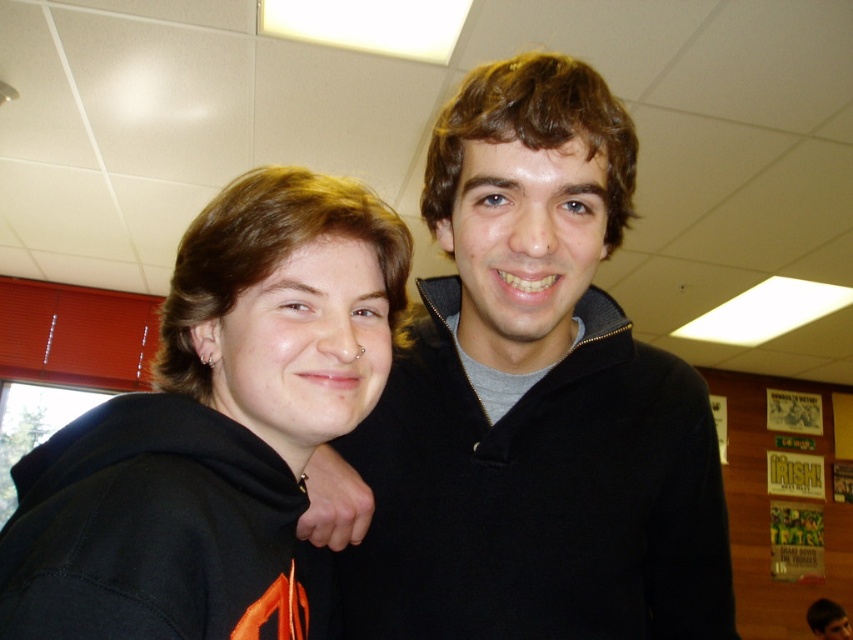
Question: Can you confirm if black hoodie at left is thinner than black matte hoodie at center?

Choices:
 (A) yes
 (B) no

Answer: (B)

Question: Observing the image, what is the correct spatial positioning of black hoodie at left in reference to black matte hoodie at center?

Choices:
 (A) above
 (B) below

Answer: (A)

Question: Does black hoodie at left have a greater width compared to black matte hoodie at center?

Choices:
 (A) yes
 (B) no

Answer: (A)

Question: Which point appears farthest from the camera in this image?

Choices:
 (A) (849, 634)
 (B) (383, 282)

Answer: (A)

Question: Which object appears farthest from the camera in this image?

Choices:
 (A) black matte hoodie at center
 (B) black hoodie at left

Answer: (A)